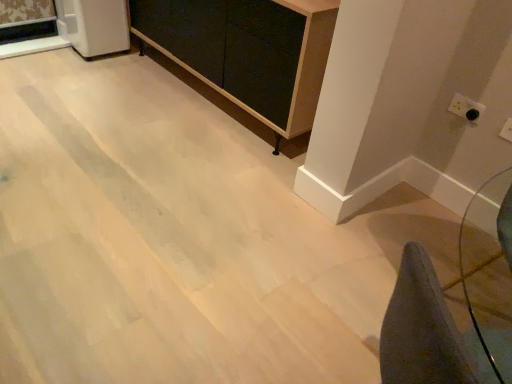
Question: Considering their positions, is matte black chalkboard at center located in front of or behind white plastic electric outlet at upper right, arranged as the 2th electric outlet when viewed from the top?

Choices:
 (A) behind
 (B) front

Answer: (A)

Question: In terms of width, does matte black chalkboard at center look wider or thinner when compared to white plastic electric outlet at upper right, the 2th electric outlet viewed from the back?

Choices:
 (A) wide
 (B) thin

Answer: (A)

Question: Which object is the closest to the white glossy refrigerator at upper left?

Choices:
 (A) matte black chalkboard at center
 (B) white plastic electric outlet at upper right, positioned as the 1th electric outlet in bottom-to-top order
 (C) white plastic electric outlet at upper right, placed as the 2th electric outlet when sorted from bottom to top

Answer: (A)

Question: Considering the real-world distances, which object is farthest from the white plastic electric outlet at upper right, which is counted as the first electric outlet, starting from the top?

Choices:
 (A) matte black chalkboard at center
 (B) white plastic electric outlet at upper right, the 2th electric outlet viewed from the back
 (C) white glossy refrigerator at upper left

Answer: (C)